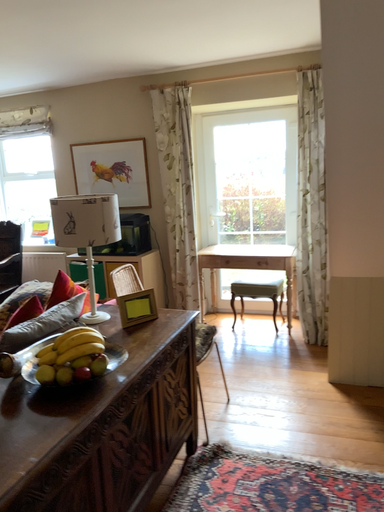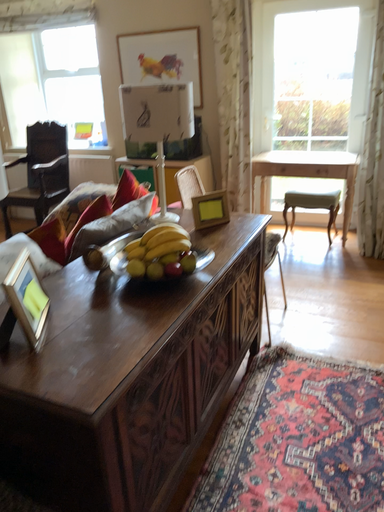
Question: Which way did the camera rotate in the video?

Choices:
 (A) rotated downward
 (B) rotated upward

Answer: (A)